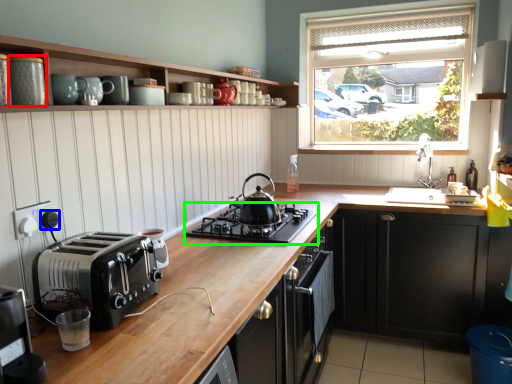
Question: Which object is the farthest from appliance (highlighted by a red box)? Choose among these: knob (highlighted by a blue box) or gas stove (highlighted by a green box).

Choices:
 (A) knob
 (B) gas stove

Answer: (B)